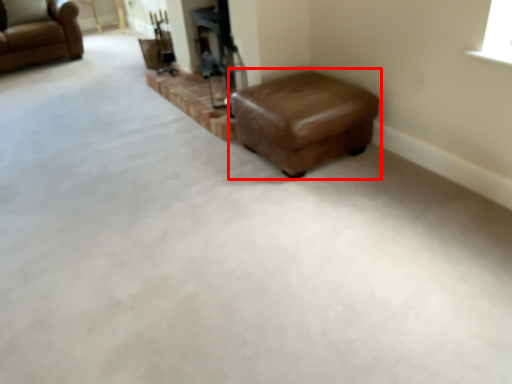
Question: From the image's perspective, what is the correct spatial relationship of stool (annotated by the red box) in relation to chair?

Choices:
 (A) above
 (B) below

Answer: (B)